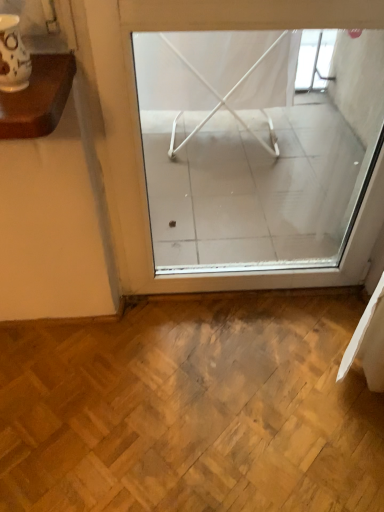
The image size is (384, 512). In order to click on vacant space underneath transparent glass window at center (from a real-world perspective) in this screenshot , I will do `click(243, 294)`.